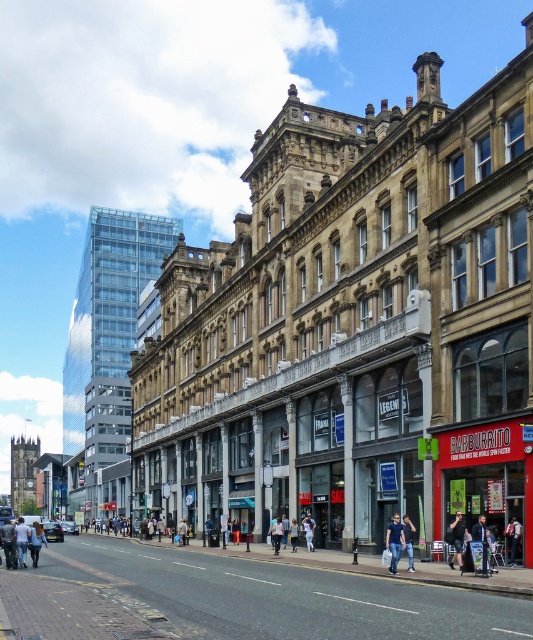
Is point (100, 604) behind point (397, 563)?

No.

Which is above, smooth asphalt road at center or dark blue jeans at center?

dark blue jeans at center is above.

The image size is (533, 640). I want to click on smooth asphalt road at center, so click(x=239, y=598).

Where is `smooth asphalt road at center`? Image resolution: width=533 pixels, height=640 pixels. smooth asphalt road at center is located at coordinates (239, 598).

Looking at this image, is red brick building at lower right bigger than black fabric person at center?

Yes.

Describe the element at coordinates (480, 456) in the screenshot. The width and height of the screenshot is (533, 640). I see `red brick building at lower right` at that location.

Where is `red brick building at lower right`? red brick building at lower right is located at coordinates (480, 456).

Who is positioned more to the right, dark blue jeans at center or denim jeans at center?

Positioned to the right is denim jeans at center.

You are a GUI agent. You are given a task and a screenshot of the screen. Output one action in this format:
    pyautogui.click(x=<x>, y=<y>)
    Task: Click on the dark blue jeans at center
    Image resolution: width=533 pixels, height=640 pixels.
    Given the screenshot: What is the action you would take?
    pyautogui.click(x=394, y=541)

Where is `dark blue jeans at center`? dark blue jeans at center is located at coordinates (394, 541).